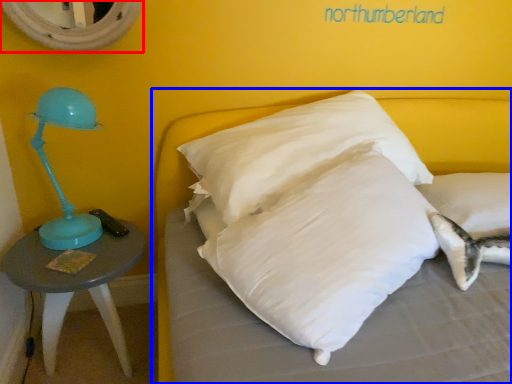
Question: Which point is closer to the camera, mirror (highlighted by a red box) or bed (highlighted by a blue box)?

Choices:
 (A) mirror
 (B) bed

Answer: (B)